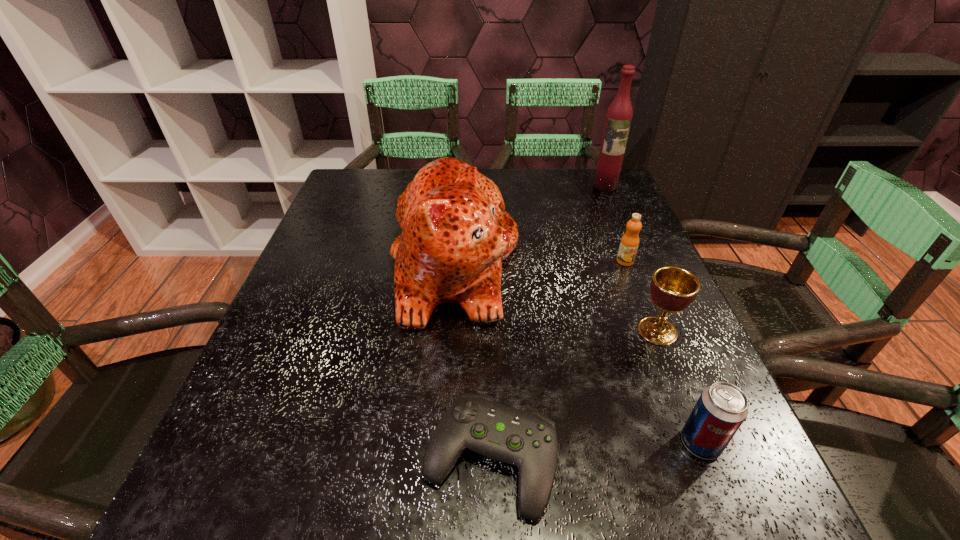
The image size is (960, 540). In order to click on vacant space located on the front label of the orange juice in this screenshot , I will do 646,316.

Where is `vacant region located 0.050m on the left of the shortest object`? vacant region located 0.050m on the left of the shortest object is located at coordinates (391, 459).

Locate an element on the screen. object that is at the far edge is located at coordinates (618, 119).

This screenshot has height=540, width=960. In order to click on object that is at the near edge in this screenshot , I will do `click(527, 439)`.

Identify the location of liquor that is at the right edge. (618, 119).

Identify the location of chalice located in the right edge section of the desktop. (673, 289).

Identify the location of orange juice positioned at the right edge. (629, 243).

Identify the location of beer can located at the right edge. (721, 409).

Locate an element on the screen. The width and height of the screenshot is (960, 540). object located in the far right corner section of the desktop is located at coordinates (618, 119).

What are the coordinates of `free region at the near edge` in the screenshot? It's located at (368, 485).